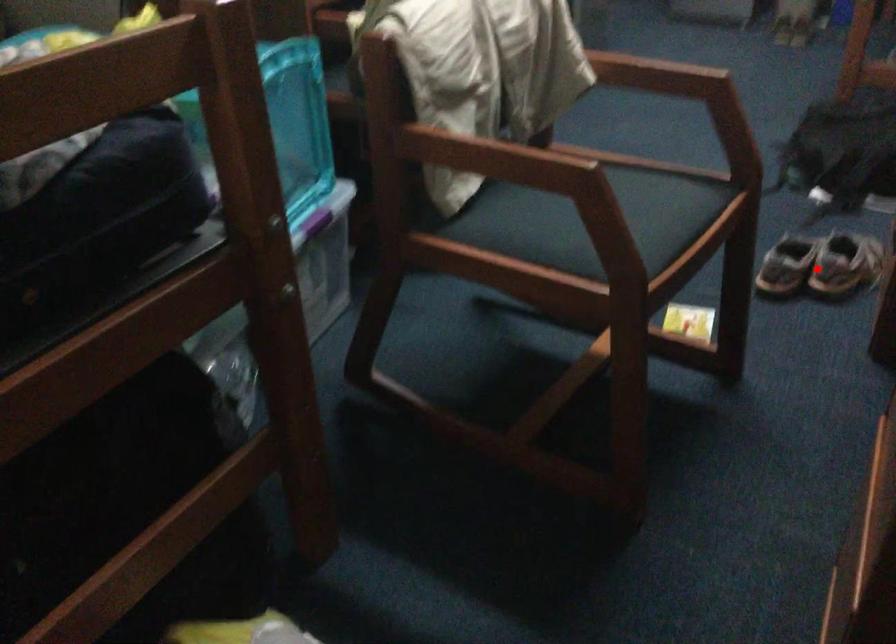
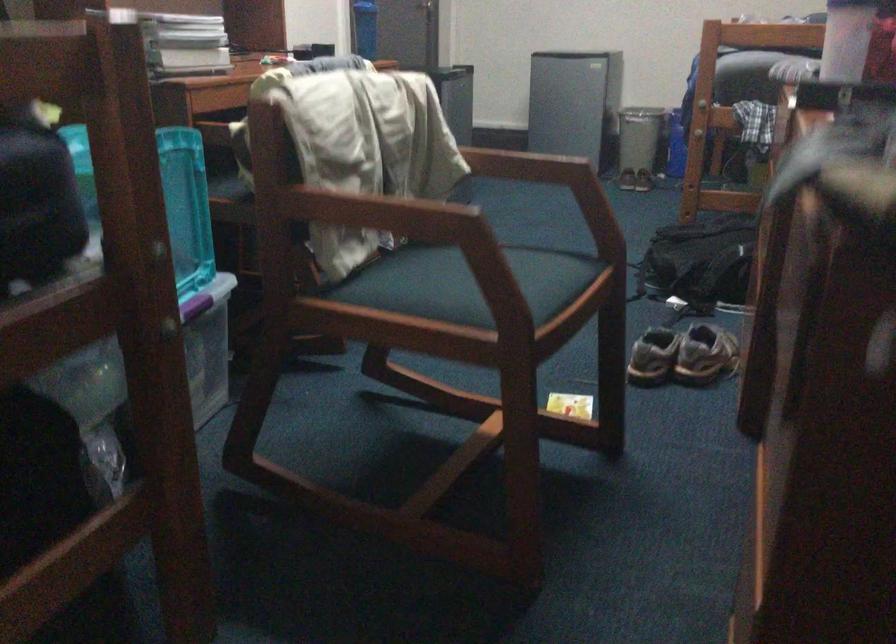
Find the pixel in the second image that matches the highlighted location in the first image.

(682, 355)